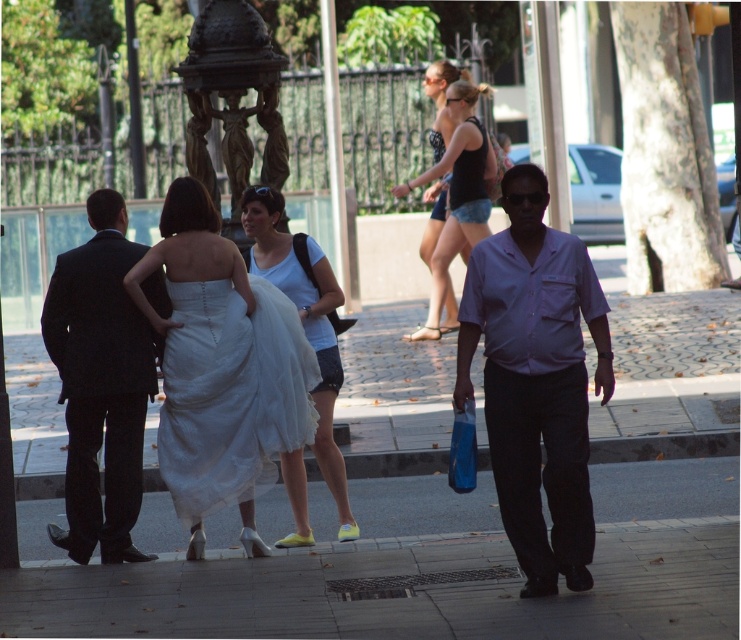
Consider the image. Can you confirm if white tulle dress at center is shorter than black denim shorts at center?

Indeed, white tulle dress at center has a lesser height compared to black denim shorts at center.

Consider the image. Is white tulle dress at center to the right of black denim shorts at center from the viewer's perspective?

Incorrect, white tulle dress at center is not on the right side of black denim shorts at center.

Measure the distance between point (x=190, y=342) and camera.

Point (x=190, y=342) and camera are 10.35 meters apart.

Locate an element on the screen. white tulle dress at center is located at coordinates (230, 394).

Between purple cotton shirt at center and white tulle dress at center, which one has more height?

purple cotton shirt at center is taller.

The height and width of the screenshot is (640, 741). I want to click on purple cotton shirt at center, so click(x=536, y=380).

Is point (536, 392) farther from viewer compared to point (245, 490)?

No, (536, 392) is closer to viewer.

The width and height of the screenshot is (741, 640). What are the coordinates of `purple cotton shirt at center` in the screenshot? It's located at (536, 380).

Which of these two, purple cotton shirt at center or black denim shorts at center, stands taller?

Standing taller between the two is black denim shorts at center.

Describe the element at coordinates (536, 380) in the screenshot. I see `purple cotton shirt at center` at that location.

In order to click on purple cotton shirt at center in this screenshot , I will do `click(536, 380)`.